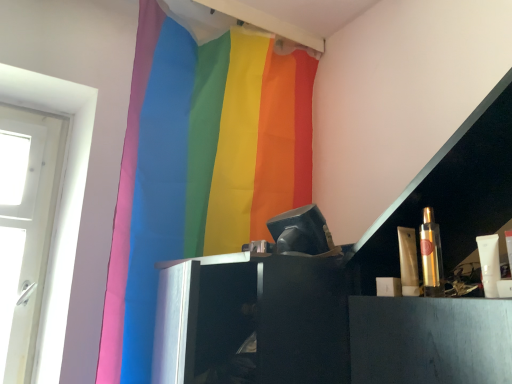
Question: From their relative heights in the image, would you say shiny gold tube at right, which is the first toiletry in left-to-right order, is taller or shorter than rainbow fabric curtain at upper center?

Choices:
 (A) tall
 (B) short

Answer: (B)

Question: From a real-world perspective, is shiny gold tube at right, which is the first toiletry in left-to-right order, positioned above or below rainbow fabric curtain at upper center?

Choices:
 (A) below
 (B) above

Answer: (A)

Question: Which of these objects is positioned closest to the rainbow fabric curtain at upper center?

Choices:
 (A) shiny gold tube at right, which is the first toiletry in left-to-right order
 (B) gold metallic spray can at right, positioned as the 2th toiletry in left-to-right order

Answer: (A)

Question: Considering the real-world distances, which object is farthest from the shiny gold tube at right, which is the first toiletry in left-to-right order?

Choices:
 (A) gold metallic spray can at right, positioned as the 2th toiletry in left-to-right order
 (B) rainbow fabric curtain at upper center

Answer: (B)